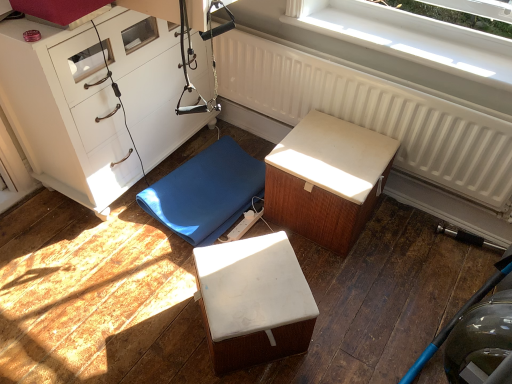
Question: Considering the positions of white plastic window at upper center and blue rubber mat at center, which is the first furniture from left to right, in the image, is white plastic window at upper center wider or thinner than blue rubber mat at center, which is the first furniture from left to right,?

Choices:
 (A) wide
 (B) thin

Answer: (B)

Question: From the image's perspective, is white plastic window at upper center located above or below blue rubber mat at center, the third furniture when ordered from right to left?

Choices:
 (A) above
 (B) below

Answer: (A)

Question: Which of these objects is positioned closest to the white textured cushion at center, which ranks as the first furniture in right-to-left order?

Choices:
 (A) white plastic window at upper center
 (B) white textured radiator at upper center
 (C) white matte chest of drawers at left
 (D) white matte cube at center, placed as the 2th furniture when sorted from left to right
 (E) blue rubber mat at center, which is the first furniture from left to right

Answer: (B)

Question: Estimate the real-world distances between objects in this image. Which object is closer to the white textured radiator at upper center?

Choices:
 (A) white matte cube at center, placed as the 2th furniture when sorted from left to right
 (B) white plastic window at upper center
 (C) white matte chest of drawers at left
 (D) blue rubber mat at center, which is the first furniture from left to right
 (E) white textured cushion at center, which is the third furniture from left to right

Answer: (B)